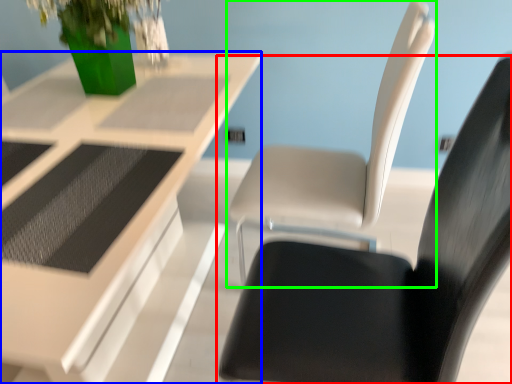
Question: Considering the real-world distances, which object is closest to chair (highlighted by a red box)? table (highlighted by a blue box) or chair (highlighted by a green box).

Choices:
 (A) table
 (B) chair

Answer: (B)